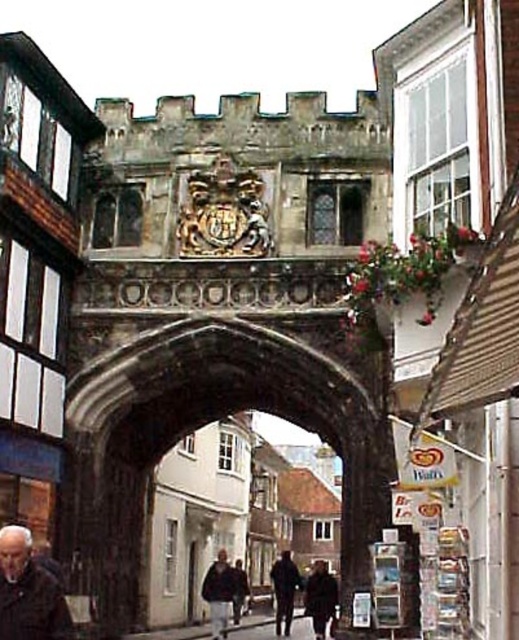
Is point (384, 525) closer to viewer compared to point (313, 602)?

That is True.

Is stone archway at center shorter than dark brown leather coat at center?

In fact, stone archway at center may be taller than dark brown leather coat at center.

Image resolution: width=519 pixels, height=640 pixels. What do you see at coordinates (211, 420) in the screenshot?
I see `stone archway at center` at bounding box center [211, 420].

Locate an element on the screen. This screenshot has width=519, height=640. stone archway at center is located at coordinates (211, 420).

Does stone archway at center come in front of dark brown leather jacket at center?

Yes, stone archway at center is closer to the viewer.

Which is behind, point (151, 467) or point (222, 600)?

Positioned behind is point (222, 600).

Find the location of `stone archway at center`. stone archway at center is located at coordinates (211, 420).

Who is shorter, dark brown leather jacket at lower left or dark brown leather coat at center?

dark brown leather jacket at lower left is shorter.

Does dark brown leather jacket at lower left appear over dark brown leather coat at center?

Correct, dark brown leather jacket at lower left is located above dark brown leather coat at center.

Does point (8, 632) lie behind point (319, 600)?

No, (8, 632) is in front of (319, 600).

Locate an element on the screen. This screenshot has width=519, height=640. dark brown leather jacket at lower left is located at coordinates (29, 593).